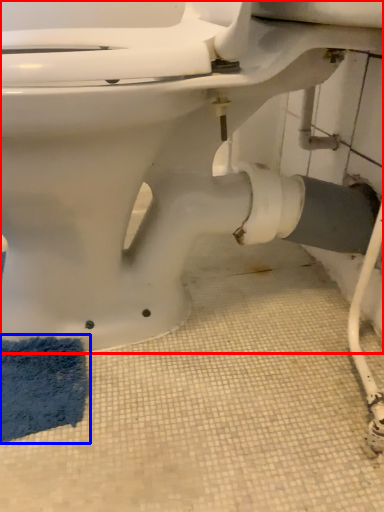
Question: Which object appears closest to the camera in this image, toilet (highlighted by a red box) or bath mat (highlighted by a blue box)?

Choices:
 (A) toilet
 (B) bath mat

Answer: (A)